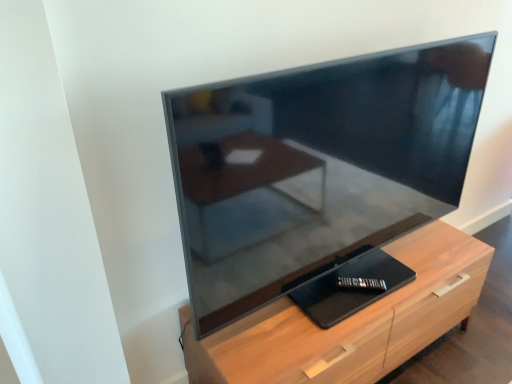
Question: Does matte black tv at center have a larger size compared to light wood chest of drawers at center?

Choices:
 (A) no
 (B) yes

Answer: (B)

Question: Is light wood chest of drawers at center completely or partially inside matte black tv at center?

Choices:
 (A) yes
 (B) no

Answer: (B)

Question: Considering the relative positions of matte black tv at center and light wood chest of drawers at center in the image provided, is matte black tv at center behind light wood chest of drawers at center?

Choices:
 (A) no
 (B) yes

Answer: (A)

Question: Can you see matte black tv at center touching light wood chest of drawers at center?

Choices:
 (A) no
 (B) yes

Answer: (A)

Question: From a real-world perspective, is matte black tv at center positioned under light wood chest of drawers at center based on gravity?

Choices:
 (A) no
 (B) yes

Answer: (A)

Question: Is matte black tv at center not inside light wood chest of drawers at center?

Choices:
 (A) no
 (B) yes

Answer: (B)

Question: From the image's perspective, is light wood chest of drawers at center on matte black tv at center?

Choices:
 (A) no
 (B) yes

Answer: (A)

Question: Is light wood chest of drawers at center in front of matte black tv at center?

Choices:
 (A) no
 (B) yes

Answer: (A)

Question: From the image's perspective, would you say light wood chest of drawers at center is shown under matte black tv at center?

Choices:
 (A) no
 (B) yes

Answer: (B)

Question: Is light wood chest of drawers at center smaller than matte black tv at center?

Choices:
 (A) no
 (B) yes

Answer: (B)

Question: Does light wood chest of drawers at center have a greater height compared to matte black tv at center?

Choices:
 (A) no
 (B) yes

Answer: (A)

Question: Is light wood chest of drawers at center in contact with matte black tv at center?

Choices:
 (A) no
 (B) yes

Answer: (A)

Question: Does point (380, 372) appear closer or farther from the camera than point (355, 289)?

Choices:
 (A) closer
 (B) farther

Answer: (B)